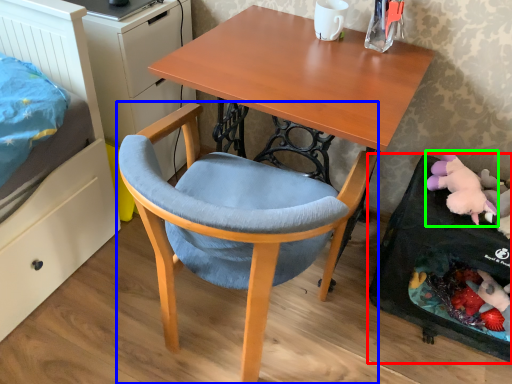
Question: Which is nearer to the desktop (highlighted by a red box)? chair (highlighted by a blue box) or toy (highlighted by a green box).

Choices:
 (A) chair
 (B) toy

Answer: (B)